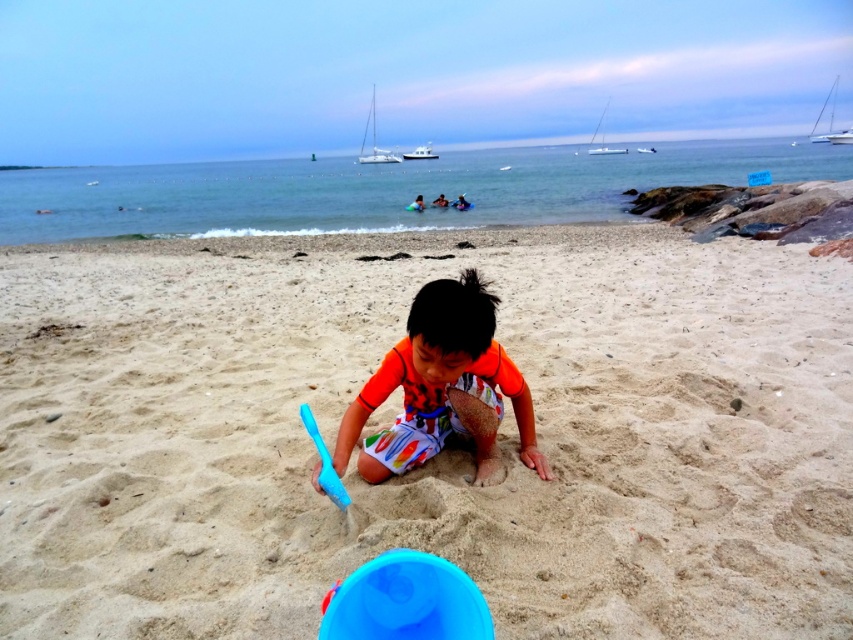
Question: Which point is closer to the camera?

Choices:
 (A) (526, 419)
 (B) (357, 634)

Answer: (B)

Question: Does orange matte shirt at center come behind blue plastic bucket at lower center?

Choices:
 (A) yes
 (B) no

Answer: (A)

Question: Can you confirm if orange matte shirt at center is positioned below blue plastic bucket at lower center?

Choices:
 (A) no
 (B) yes

Answer: (A)

Question: Among these objects, which one is nearest to the camera?

Choices:
 (A) orange matte shirt at center
 (B) blue plastic bucket at lower center
 (C) smooth sand at center

Answer: (B)

Question: Does orange matte shirt at center appear on the right side of blue plastic bucket at lower center?

Choices:
 (A) yes
 (B) no

Answer: (A)

Question: Which object appears farthest from the camera in this image?

Choices:
 (A) blue plastic bucket at lower center
 (B) smooth sand at center

Answer: (B)